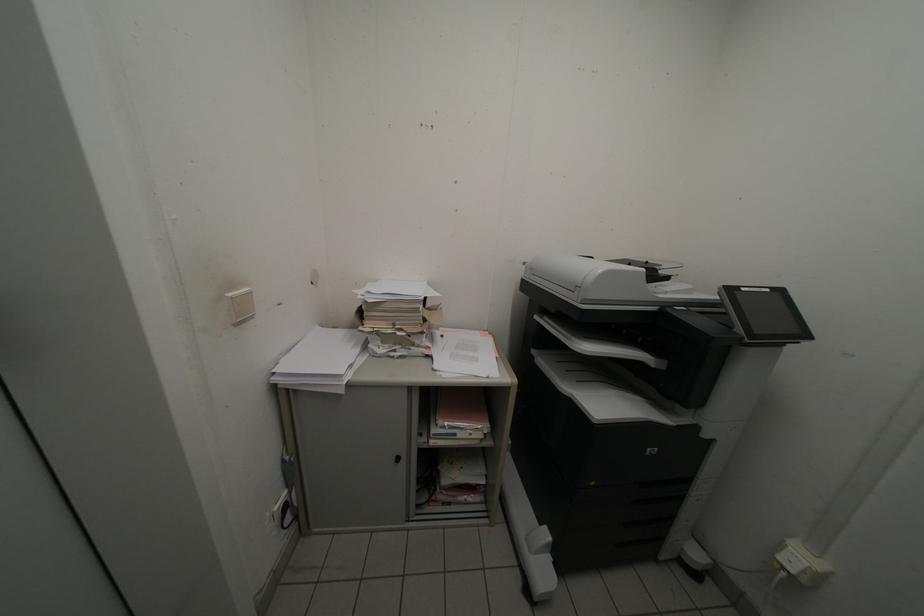
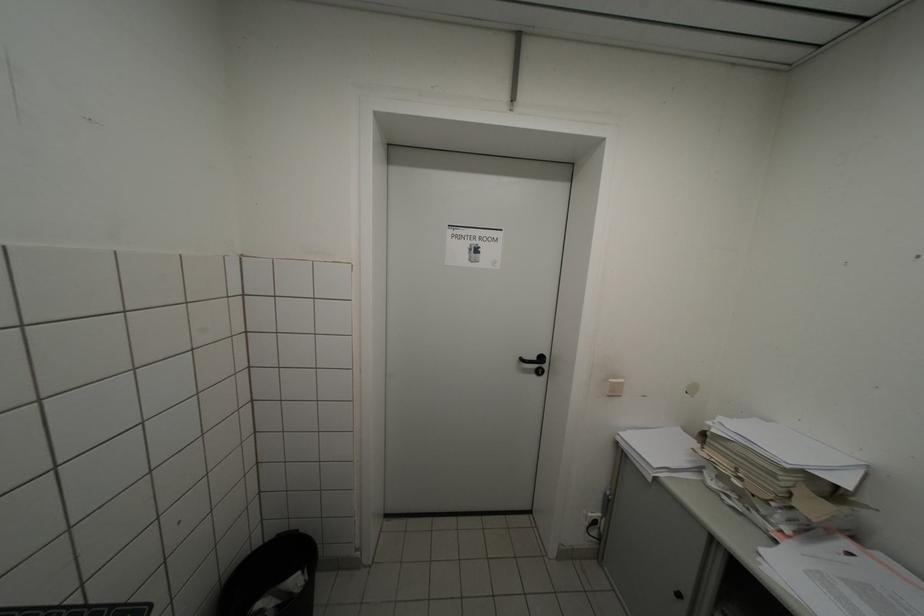
In the second image, find the point that corresponds to the point at 237,297 in the first image.

(618, 383)